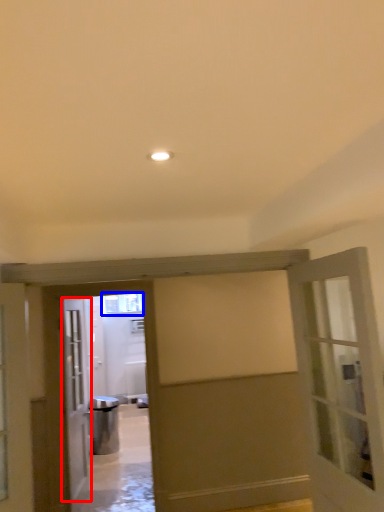
Question: Which object appears farthest to the camera in this image, door (highlighted by a red box) or window (highlighted by a blue box)?

Choices:
 (A) door
 (B) window

Answer: (B)